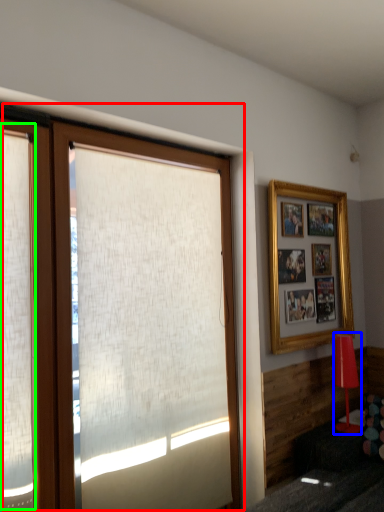
Question: Which object is positioned closest to window (highlighted by a red box)? Select from lamp (highlighted by a blue box) and shutter (highlighted by a green box).

Choices:
 (A) lamp
 (B) shutter

Answer: (B)